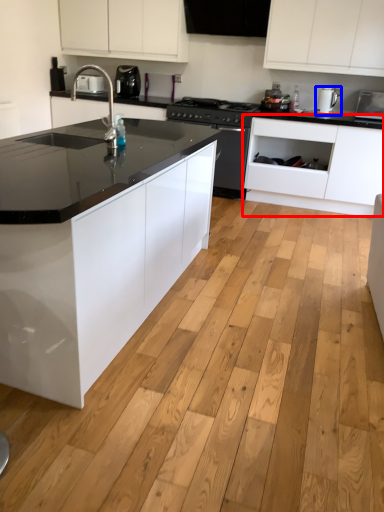
Question: Which object is closer to the camera taking this photo, cabinetry (highlighted by a red box) or kitchen appliance (highlighted by a blue box)?

Choices:
 (A) cabinetry
 (B) kitchen appliance

Answer: (A)